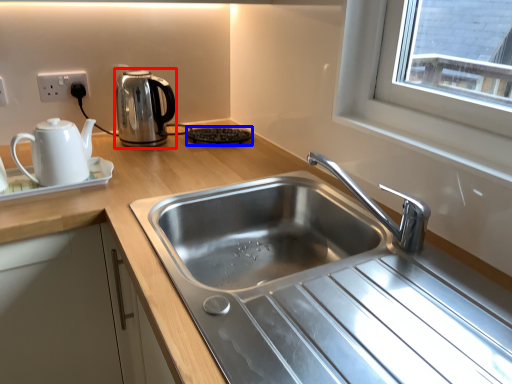
Question: Which of the following is the closest to the observer, kettle (highlighted by a red box) or appliance (highlighted by a blue box)?

Choices:
 (A) kettle
 (B) appliance

Answer: (A)